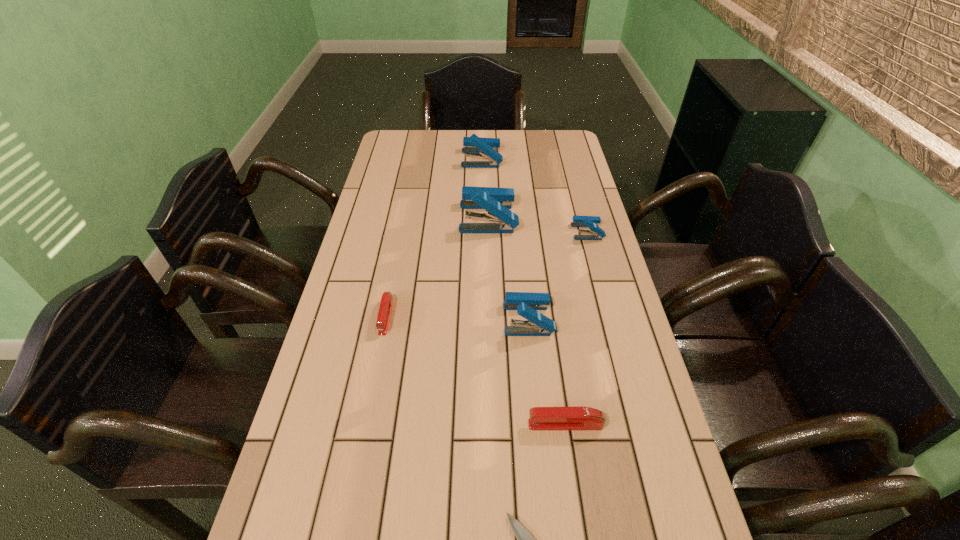
Locate an element on the screen. The width and height of the screenshot is (960, 540). vacant point located between the fourth shortest object and the leftmost object is located at coordinates (487, 274).

Where is `empty space that is in between the smallest blue stapler and the fifth tallest object`? empty space that is in between the smallest blue stapler and the fifth tallest object is located at coordinates (576, 328).

In order to click on empty location between the leftmost object and the sixth shortest object in this screenshot , I will do `click(434, 238)`.

Identify the location of free space between the fourth tallest stapler and the nearest blue stapler. The image size is (960, 540). (558, 275).

Select which object appears as the fourth closest to the steak knife. Please provide its 2D coordinates. Your answer should be formatted as a tuple, i.e. [(x, y)], where the tuple contains the x and y coordinates of a point satisfying the conditions above.

[(597, 233)]

At what (x,y) coordinates should I click in order to perform the action: click on object that ranks as the closest to the biggest blue stapler. Please return your answer as a coordinate pair (x, y). Looking at the image, I should click on (597, 233).

I want to click on stapler that stands as the second closest to the nearest stapler, so click(385, 307).

Select which stapler is the closest to the shortest object. Please provide its 2D coordinates. Your answer should be formatted as a tuple, i.e. [(x, y)], where the tuple contains the x and y coordinates of a point satisfying the conditions above.

[(541, 418)]

Locate which blue stapler is the closest to the tallest stapler. Please provide its 2D coordinates. Your answer should be formatted as a tuple, i.e. [(x, y)], where the tuple contains the x and y coordinates of a point satisfying the conditions above.

[(597, 233)]

Locate which blue stapler ranks in proximity to the tallest object. Please provide its 2D coordinates. Your answer should be formatted as a tuple, i.e. [(x, y)], where the tuple contains the x and y coordinates of a point satisfying the conditions above.

[(597, 233)]